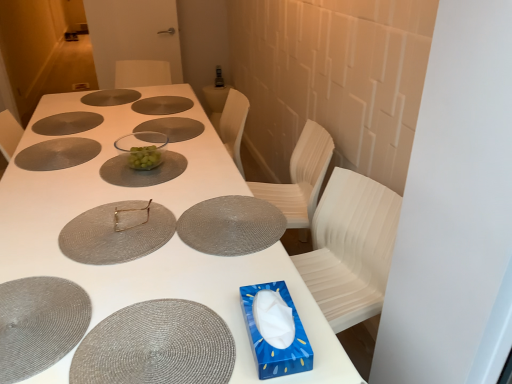
You are a GUI agent. You are given a task and a screenshot of the screen. Output one action in this format:
    pyautogui.click(x=<x>, y=<y>)
    Task: Click on the free location in front of matte gray placemat at center, placed as the seventh glass plate when sorted from back to front
    The height and width of the screenshot is (384, 512).
    Given the screenshot: What is the action you would take?
    pyautogui.click(x=216, y=272)